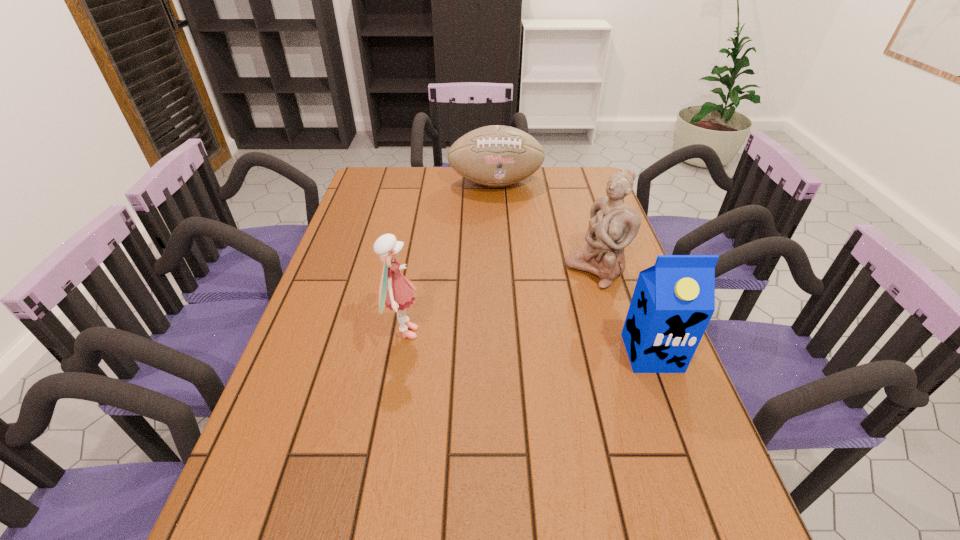
Locate an element on the screen. This screenshot has width=960, height=540. free space between the carton and the second farthest object is located at coordinates (624, 312).

Locate an element on the screen. The width and height of the screenshot is (960, 540). vacant space in between the second farthest object and the carton is located at coordinates (624, 312).

Locate an element on the screen. This screenshot has width=960, height=540. object that is the third closest to the figurine is located at coordinates (395, 292).

Where is `object that is the third closest to the second farthest object`? This screenshot has height=540, width=960. object that is the third closest to the second farthest object is located at coordinates (395, 292).